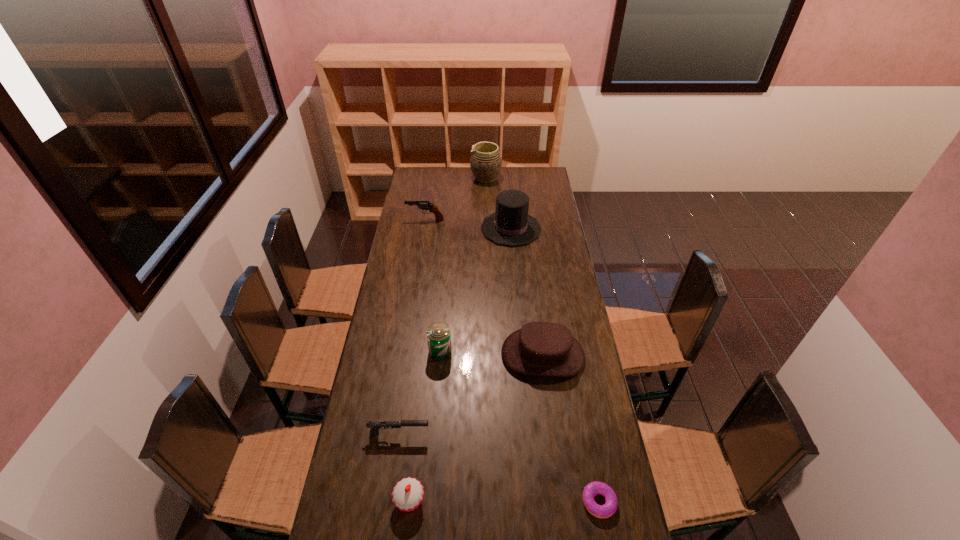
Where is `pottery`? This screenshot has width=960, height=540. pottery is located at coordinates (486, 161).

Identify the location of the farther hat. (511, 225).

Where is `the taller gun`? This screenshot has height=540, width=960. the taller gun is located at coordinates (424, 205).

Find the location of a particular element. Image resolution: width=960 pixels, height=540 pixels. can is located at coordinates (438, 334).

The image size is (960, 540). I want to click on the nearer hat, so click(539, 348).

Locate an element on the screen. the third shortest object is located at coordinates (407, 495).

Where is `the shorter gun`? the shorter gun is located at coordinates (375, 425).

Find the location of `the third nearest object`. the third nearest object is located at coordinates (375, 425).

I want to click on doughnut, so pos(592,489).

Locate an element on the screen. Image resolution: width=960 pixels, height=540 pixels. free space located 0.280m on the left of the farthest object is located at coordinates (422, 178).